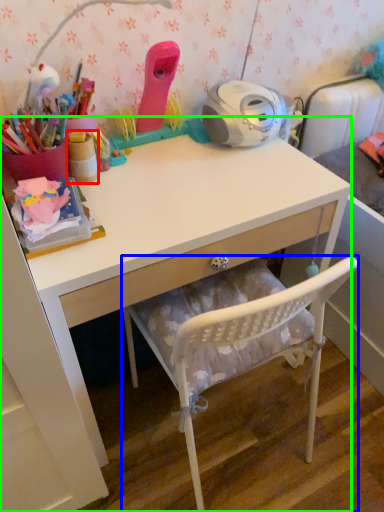
Question: Which object is the closest to the stationery (highlighted by a red box)? Choose among these: chair (highlighted by a blue box) or desk (highlighted by a green box).

Choices:
 (A) chair
 (B) desk

Answer: (B)